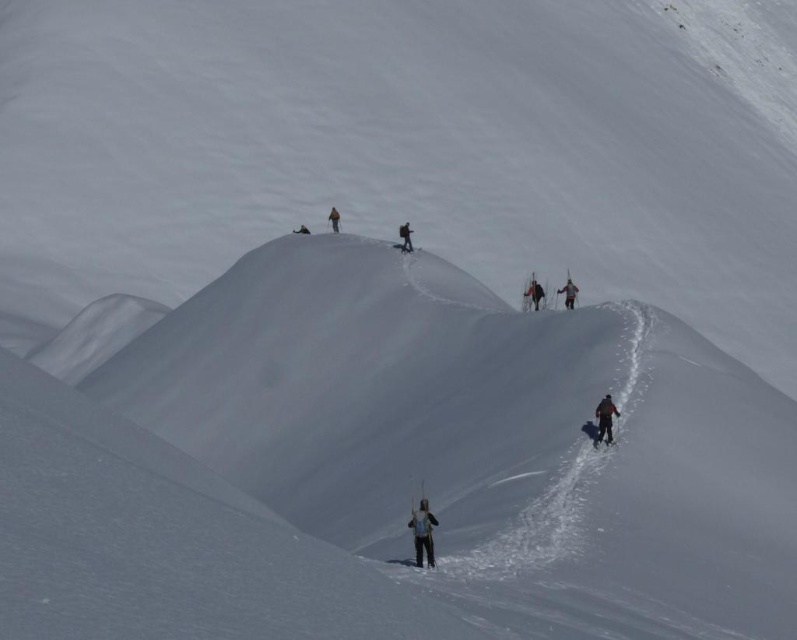
Is point (532, 292) farther from camera compared to point (338, 212)?

No, (532, 292) is in front of (338, 212).

The width and height of the screenshot is (797, 640). What do you see at coordinates (536, 292) in the screenshot?
I see `black matte skier at center` at bounding box center [536, 292].

The image size is (797, 640). Describe the element at coordinates (536, 292) in the screenshot. I see `black matte skier at center` at that location.

Where is `black matte skier at center`? This screenshot has height=640, width=797. black matte skier at center is located at coordinates (536, 292).

Measure the distance between white fabric jacket at center and camera.

white fabric jacket at center is 28.79 meters from camera.

Describe the element at coordinates (422, 532) in the screenshot. I see `white fabric jacket at center` at that location.

You are a GUI agent. You are given a task and a screenshot of the screen. Output one action in this format:
    pyautogui.click(x=<x>, y=<y>)
    Task: Click on the white fabric jacket at center
    This screenshot has height=640, width=797.
    Given the screenshot: What is the action you would take?
    pyautogui.click(x=422, y=532)

Is white fabric jacket at center taller than black fabric backpack at center?

No.

Is point (430, 522) more distant than point (403, 250)?

No, (430, 522) is closer to viewer.

Which is behind, point (432, 561) or point (407, 241)?

Point (407, 241)

Find the location of a particular element. Image resolution: width=797 pixels, height=640 pixels. white fabric jacket at center is located at coordinates (422, 532).